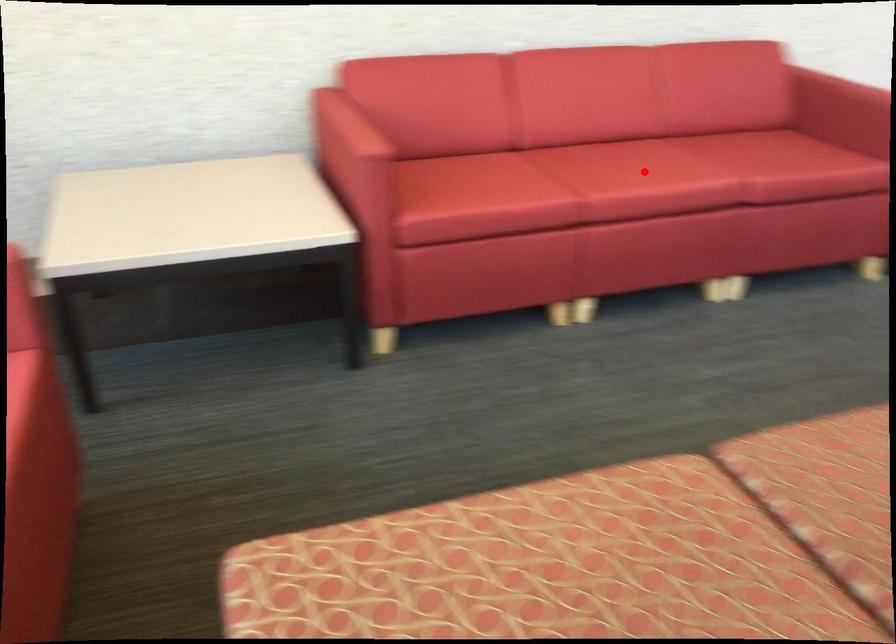
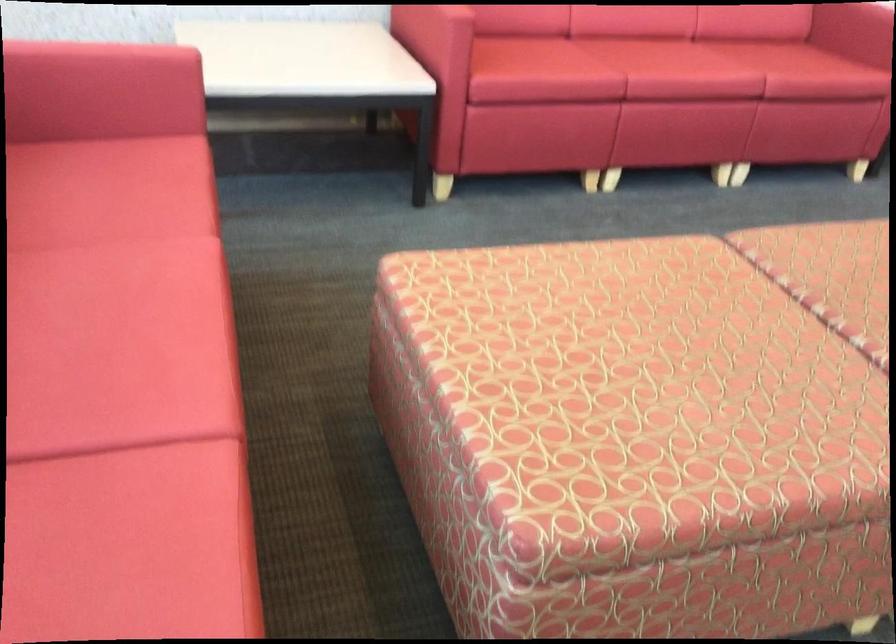
The point at the highlighted location is marked in the first image. Where is the corresponding point in the second image?

(677, 62)